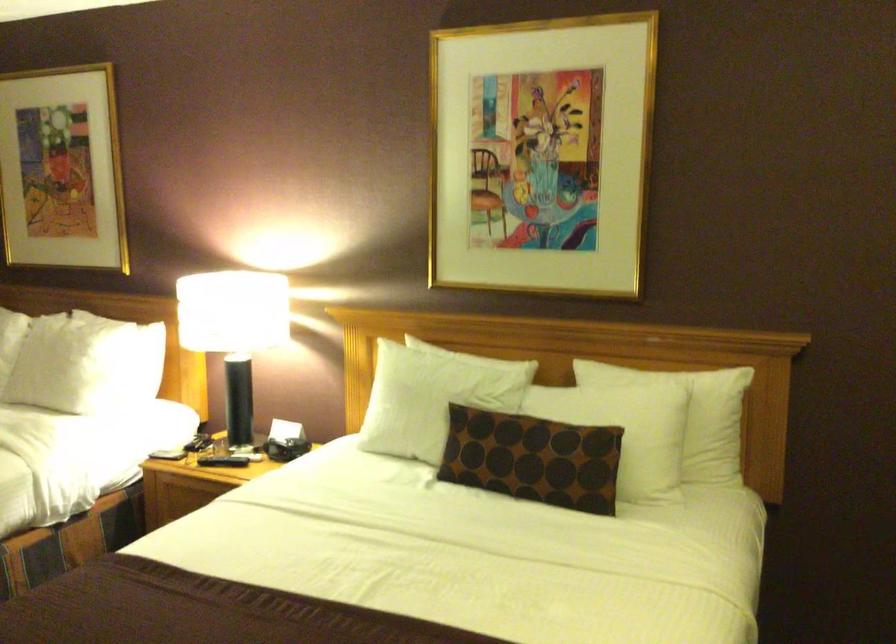
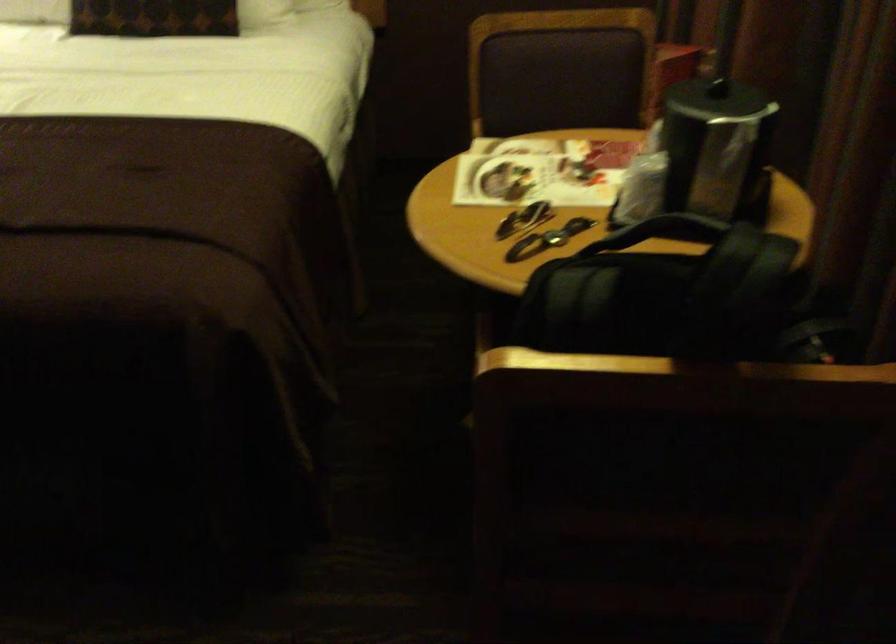
The point at (x=529, y=480) is marked in the first image. Where is the corresponding point in the second image?

(152, 17)